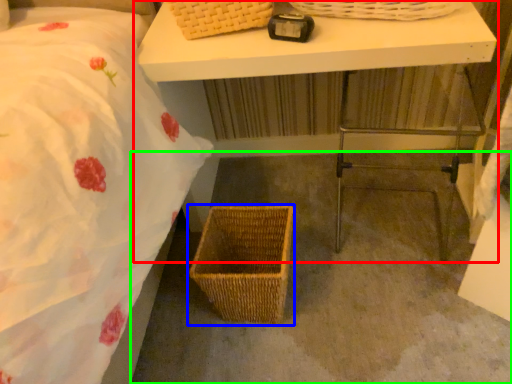
Question: Estimate the real-world distances between objects in this image. Which object is farther from table (highlighted by a red box), picnic basket (highlighted by a blue box) or concrete (highlighted by a green box)?

Choices:
 (A) picnic basket
 (B) concrete

Answer: (A)